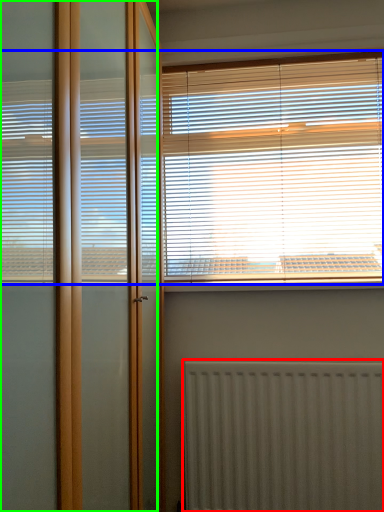
Question: Which object is positioned closest to radiator (highlighted by a red box)? Select from window blind (highlighted by a blue box) and screen door (highlighted by a green box).

Choices:
 (A) window blind
 (B) screen door

Answer: (A)